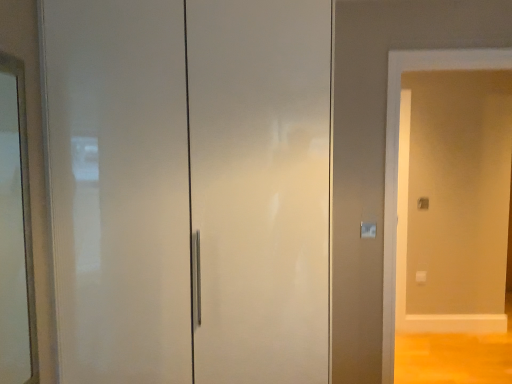
Locate an element on the screen. Image resolution: width=512 pixels, height=384 pixels. clear glass mirror at left is located at coordinates pos(15,234).

Is white glossy door at center completely or partially inside clear glass mirror at left?

Definitely not — white glossy door at center is not inside clear glass mirror at left.

Looking at this image, from a real-world perspective, which object stands above the other?

white glossy door at center is physically above.

Considering the sizes of objects clear glass mirror at left and white glossy door at center in the image provided, who is wider, clear glass mirror at left or white glossy door at center?

white glossy door at center is wider.

Locate an element on the screen. door above the clear glass mirror at left (from the image's perspective) is located at coordinates [x=190, y=189].

Does clear glass mirror at left have a smaller size compared to matte white screen door at right?

Correct, clear glass mirror at left occupies less space than matte white screen door at right.

Is clear glass mirror at left not inside matte white screen door at right?

Yes, clear glass mirror at left is not within matte white screen door at right.

I want to click on mirror located on the left of matte white screen door at right, so click(x=15, y=234).

From the image's perspective, is clear glass mirror at left above matte white screen door at right?

Yes.

In the scene shown: Which is more to the right, matte white screen door at right or white glossy door at center?

From the viewer's perspective, matte white screen door at right appears more on the right side.

From the picture: Is matte white screen door at right facing away from white glossy door at center?

No, matte white screen door at right's orientation is not away from white glossy door at center.

From a real-world perspective, which is physically below, matte white screen door at right or white glossy door at center?

matte white screen door at right.

Which object is further away from the camera taking this photo, matte white screen door at right or clear glass mirror at left?

matte white screen door at right is behind.

Is matte white screen door at right outside of clear glass mirror at left?

Indeed, matte white screen door at right is completely outside clear glass mirror at left.

From the image's perspective, between matte white screen door at right and clear glass mirror at left, who is located below?

matte white screen door at right.

Which of these two, matte white screen door at right or clear glass mirror at left, is wider?

With larger width is matte white screen door at right.

Is point (204, 79) closer or farther from the camera than point (10, 351)?

Clearly, point (204, 79) is closer to the camera than point (10, 351).

In the scene shown: Is clear glass mirror at left at the back of white glossy door at center?

No, white glossy door at center is not facing the opposite direction of clear glass mirror at left.

Considering the relative sizes of white glossy door at center and clear glass mirror at left in the image provided, is white glossy door at center thinner than clear glass mirror at left?

No, white glossy door at center is not thinner than clear glass mirror at left.

From the image's perspective, is white glossy door at center beneath clear glass mirror at left?

No.

Is white glossy door at center looking in the opposite direction of matte white screen door at right?

That's not correct — white glossy door at center is not looking away from matte white screen door at right.

Is white glossy door at center next to matte white screen door at right?

white glossy door at center is not next to matte white screen door at right, and they're not touching.

Considering the sizes of white glossy door at center and matte white screen door at right in the image, is white glossy door at center bigger or smaller than matte white screen door at right?

In the image, white glossy door at center appears to be larger than matte white screen door at right.

This screenshot has height=384, width=512. What are the coordinates of `screen door on the right of white glossy door at center` in the screenshot? It's located at (453, 200).

I want to click on mirror on the left of the white glossy door at center, so click(15, 234).

Locate an element on the screen. The height and width of the screenshot is (384, 512). mirror above the matte white screen door at right (from a real-world perspective) is located at coordinates (15, 234).

Looking at the image, which one is located closer to matte white screen door at right, clear glass mirror at left or white glossy door at center?

white glossy door at center.

Considering their positions, is matte white screen door at right positioned closer to white glossy door at center than clear glass mirror at left?

Among the two, clear glass mirror at left is located nearer to white glossy door at center.

Looking at this image, when comparing their distances from matte white screen door at right, does white glossy door at center or clear glass mirror at left seem further?

The object further to matte white screen door at right is clear glass mirror at left.

Considering their positions, is white glossy door at center positioned closer to clear glass mirror at left than matte white screen door at right?

white glossy door at center lies closer to clear glass mirror at left than the other object.

Based on their spatial positions, is matte white screen door at right or white glossy door at center further from clear glass mirror at left?

The object further to clear glass mirror at left is matte white screen door at right.

From the picture: Which object lies nearer to the anchor point white glossy door at center, clear glass mirror at left or matte white screen door at right?

A: clear glass mirror at left.

This screenshot has width=512, height=384. Find the location of `door situated between clear glass mirror at left and matte white screen door at right from left to right`. door situated between clear glass mirror at left and matte white screen door at right from left to right is located at coordinates (190, 189).